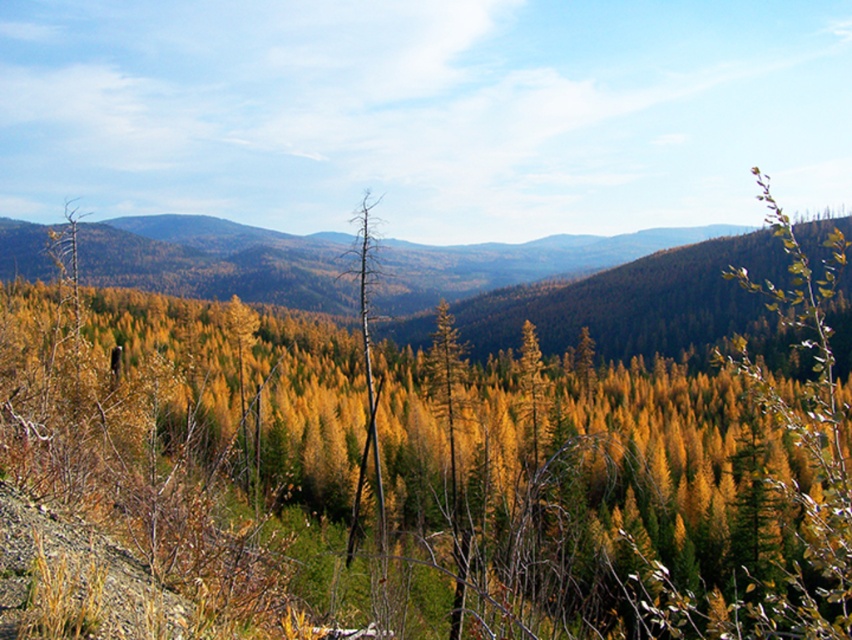
You are a hiker standing at the point with coordinates point (367, 371). You want to reach the point with coordinates point (668, 376). Which direction should you move to get there?

You should move forward because point (668, 376) is behind point (367, 371), meaning it is in the direction you are facing as you look into the scene.

You are standing in a forest and want to take a photo of the green forested mountain at upper center. If your camera has a maximum focus range of 130 feet, will it be able to capture the mountain clearly?

The green forested mountain at upper center and camera are 129.97 feet apart. Since the distance is within the camera maximum focus range of 130 feet, the camera can capture the mountain clearly.